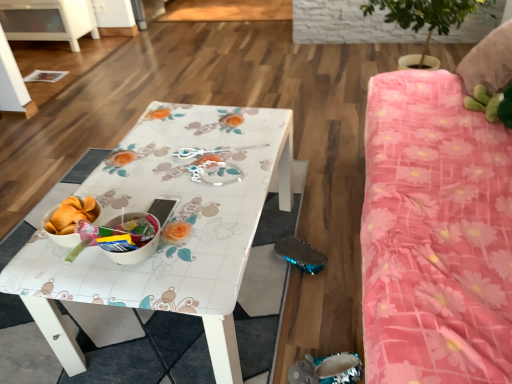
This screenshot has height=384, width=512. What are the coordinates of `unoccupied region to the right of clear plastic spoon at center` in the screenshot? It's located at pyautogui.click(x=265, y=140).